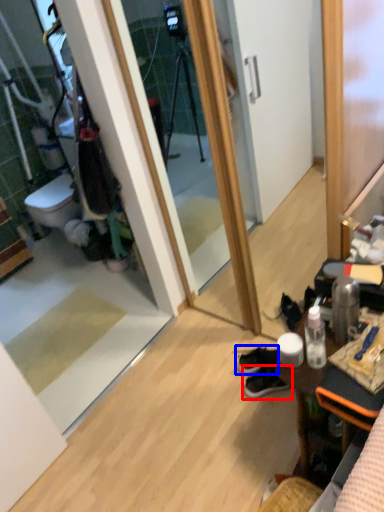
Question: Which object is further to the camera taking this photo, footwear (highlighted by a red box) or footwear (highlighted by a blue box)?

Choices:
 (A) footwear
 (B) footwear

Answer: (B)